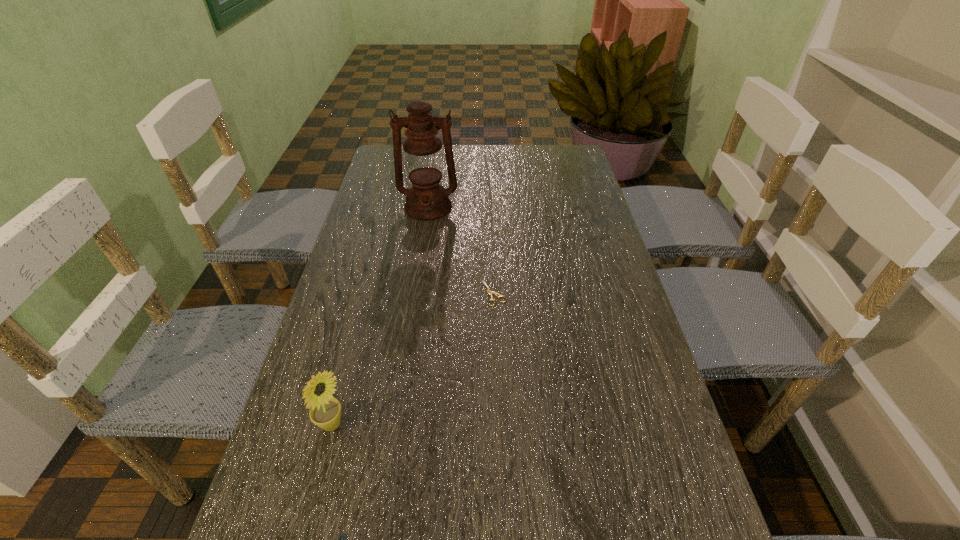
Locate an element on the screen. The image size is (960, 540). oil lamp is located at coordinates (426, 200).

The image size is (960, 540). Find the location of `the tallest object`. the tallest object is located at coordinates point(426,200).

Locate an element on the screen. The width and height of the screenshot is (960, 540). the third farthest object is located at coordinates (325, 412).

Locate an element on the screen. This screenshot has height=540, width=960. sunflower is located at coordinates (325, 412).

Locate an element on the screen. the rightmost object is located at coordinates 490,293.

Find the location of `the right shears`. the right shears is located at coordinates (490, 293).

Where is `vacant space located on the front of the oil lamp`? Image resolution: width=960 pixels, height=540 pixels. vacant space located on the front of the oil lamp is located at coordinates [413, 307].

This screenshot has height=540, width=960. What are the coordinates of `vacant region located 0.390m on the face of the second nearest object` in the screenshot? It's located at (548, 424).

You are a GUI agent. You are given a task and a screenshot of the screen. Output one action in this format:
    pyautogui.click(x=<x>, y=<y>)
    Task: Click on the free space located 0.210m on the left of the right shears
    
    Given the screenshot: What is the action you would take?
    pyautogui.click(x=398, y=293)

Where is `oil lamp present at the left edge`? The width and height of the screenshot is (960, 540). oil lamp present at the left edge is located at coordinates pyautogui.click(x=426, y=200).